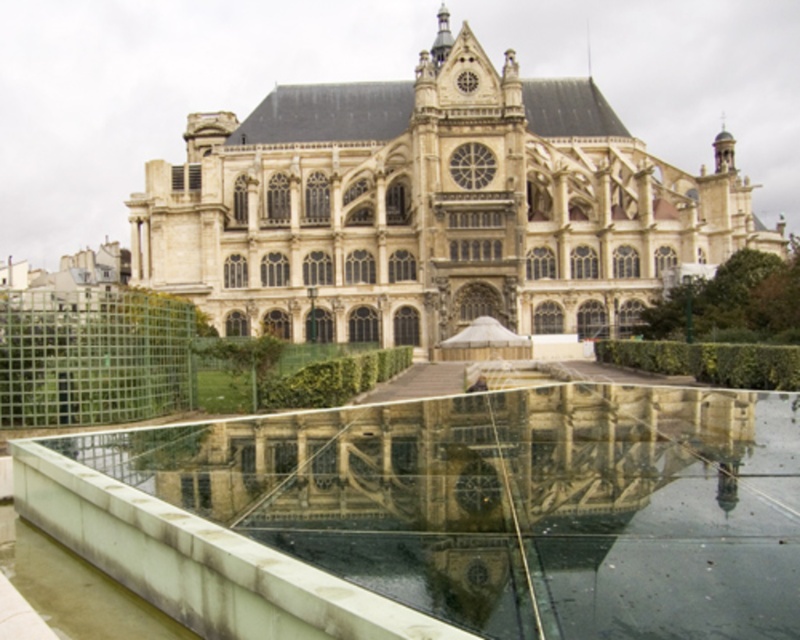
Does point (702, 625) lie in front of point (540, 278)?

Yes.

Can you confirm if clear glass pool at center is bigger than beige stone church at center?

No, clear glass pool at center is not bigger than beige stone church at center.

Does point (316, 417) come in front of point (652, 241)?

Yes.

This screenshot has height=640, width=800. I want to click on clear glass pool at center, so click(449, 515).